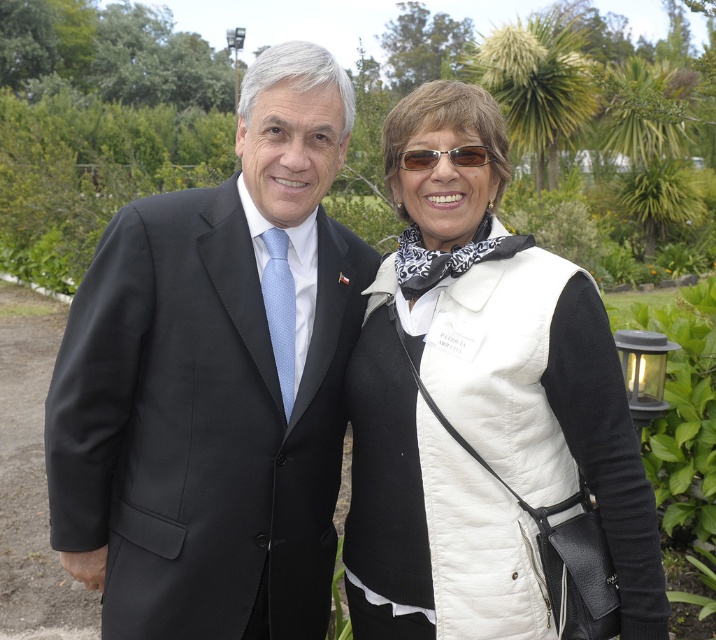
You are a photographer setting up for a group photo. You have two subjects wearing the black matte suit at center and the white quilted vest at center. To ensure both are framed properly, which clothing item should you adjust the camera focus on first?

The black matte suit at center is larger in size than the white quilted vest at center, so you should focus on the black matte suit at center first to ensure proper framing.

You are a photographer positioned at point 0,0. You need to capture a photo of the black matte suit at center. Which direction should you move to get a better shot?

The black matte suit at center is located at point (216, 381), so you should move towards the coordinates to frame the subject properly.

You are a photographer trying to capture a closeup of the black matte suit at center and the white quilted vest at center. Since you want both to be in focus, which one should you focus on first, the one closer to you or the one further away?

The black matte suit at center is located above the white quilted vest at center. To ensure both are in focus, you should focus on the one further away first, as depth of field typically extends more behind the point of focus than in front.